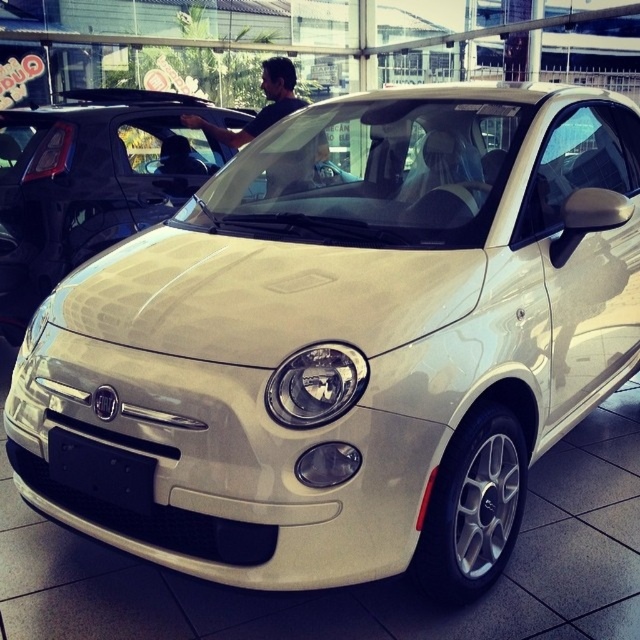
You are standing in a car showroom and see a car at the point with coordinates [92,180]. What color is the car located at that point?

The car at point [92,180] is the white glossy car at center.

You are a delivery person who needs to place a small package on the black plastic license plate at front and the dark brown leather jacket at center. Which object has a smaller width to place the package?

The black plastic license plate at front has a lesser width compared to the dark brown leather jacket at center, so the package should be placed on the black plastic license plate at front since it is narrower.